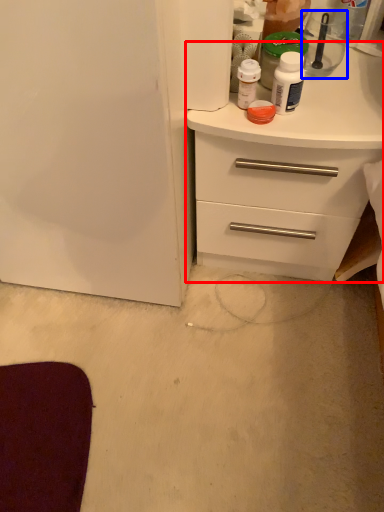
Question: Which object appears farthest to the camera in this image, chest of drawers (highlighted by a red box) or appliance (highlighted by a blue box)?

Choices:
 (A) chest of drawers
 (B) appliance

Answer: (B)